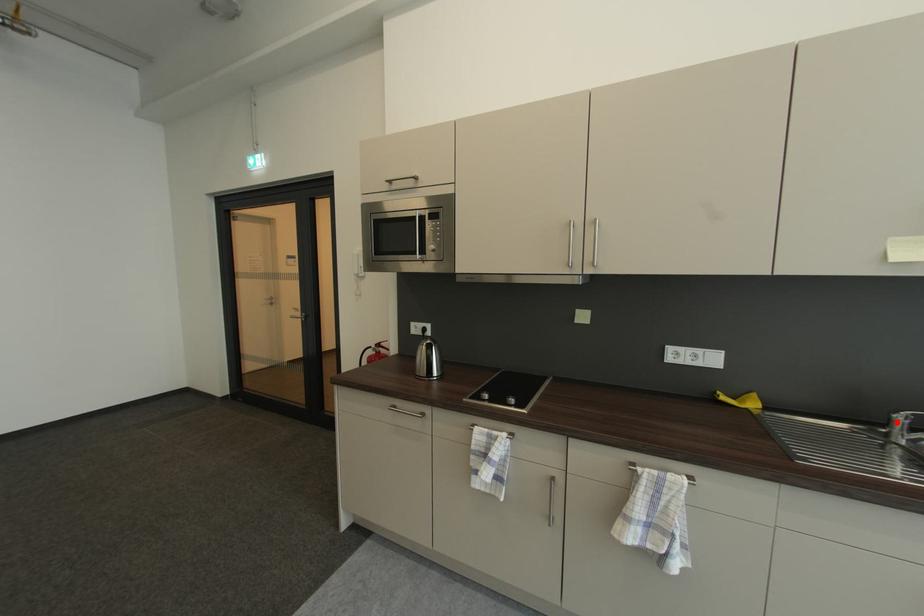
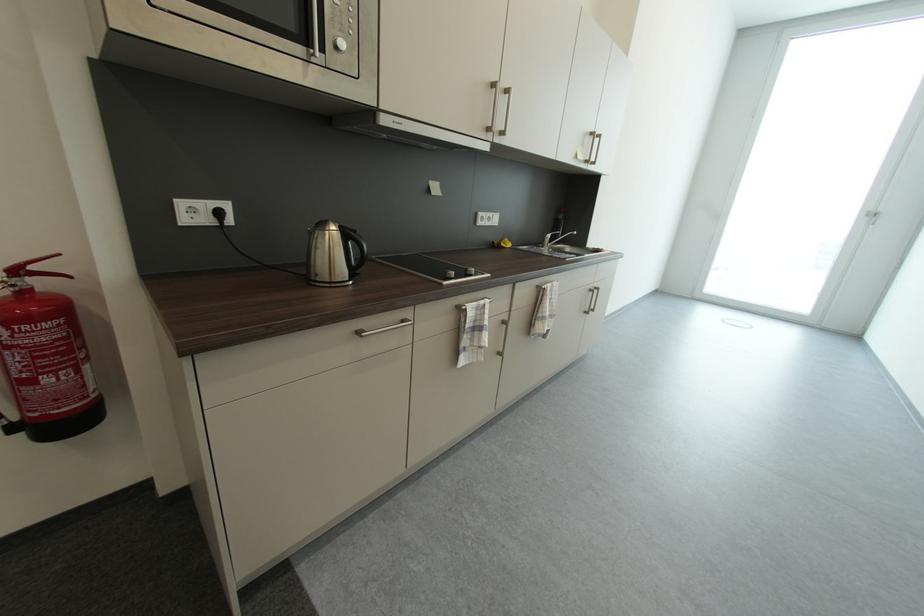
The point at the highlighted location is marked in the first image. Where is the corresponding point in the second image?

(550, 241)